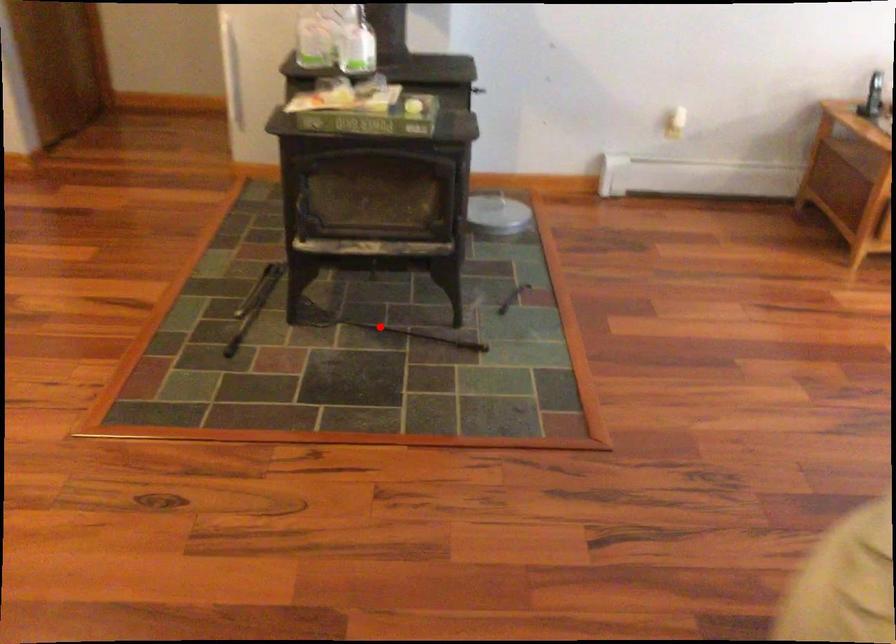
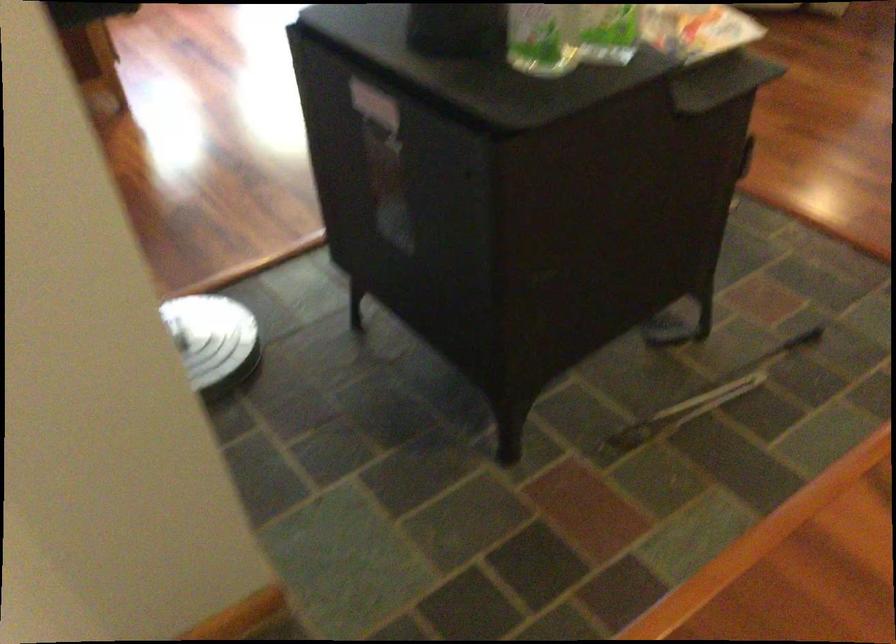
Question: I am providing you with two images of the same scene from different viewpoints. A red point is marked on the first image. Is the red point's position out of view in image 2?

Choices:
 (A) Yes
 (B) No

Answer: (A)